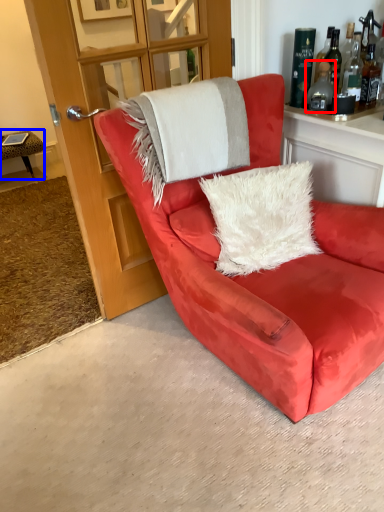
Question: Which point is further to the camera, bottle (highlighted by a red box) or table (highlighted by a blue box)?

Choices:
 (A) bottle
 (B) table

Answer: (B)